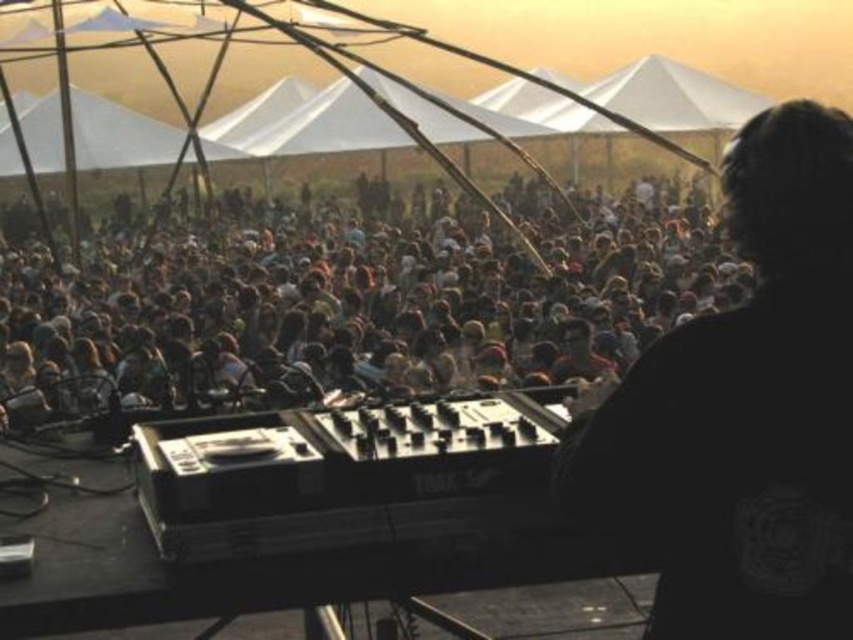
Does brown hair at center appear over black matte headphones at right?

Correct, brown hair at center is located above black matte headphones at right.

Does brown hair at center have a greater width compared to black matte headphones at right?

Correct, the width of brown hair at center exceeds that of black matte headphones at right.

Between point (686, 230) and point (759, 275), which one is positioned behind?

The point (686, 230) is behind.

Where is `brown hair at center`? The width and height of the screenshot is (853, 640). brown hair at center is located at coordinates (350, 304).